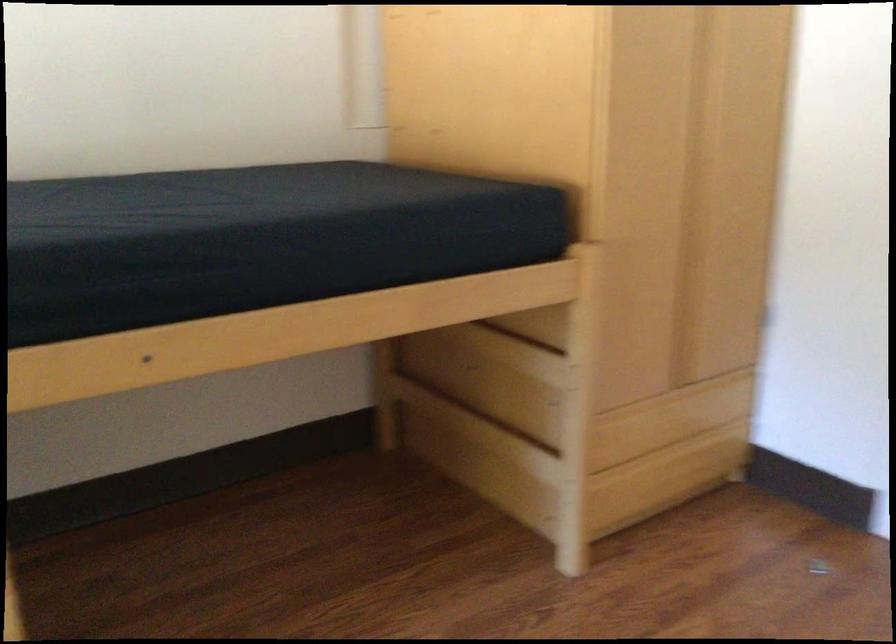
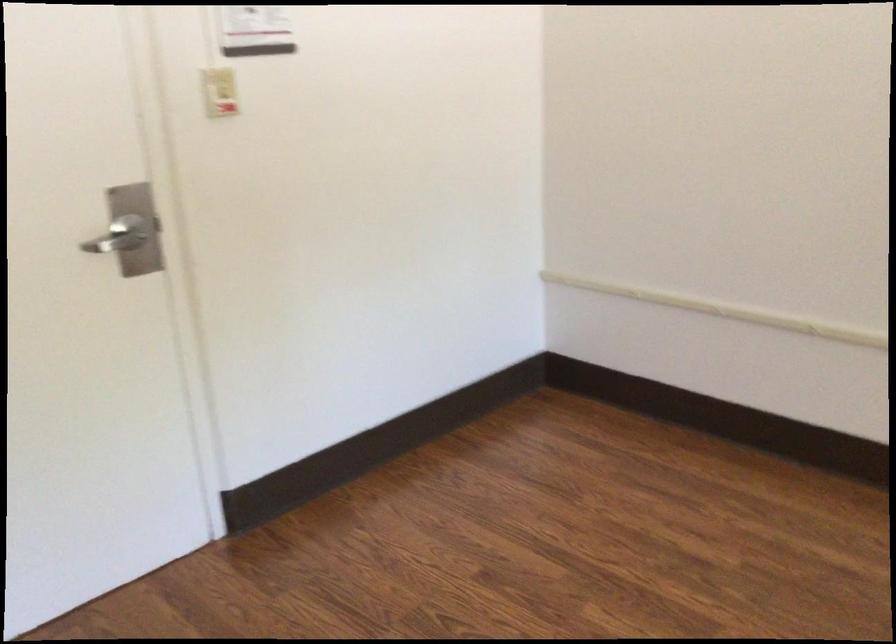
Based on the continuous images, in which direction is the camera rotating?

The camera rotated toward right-down.